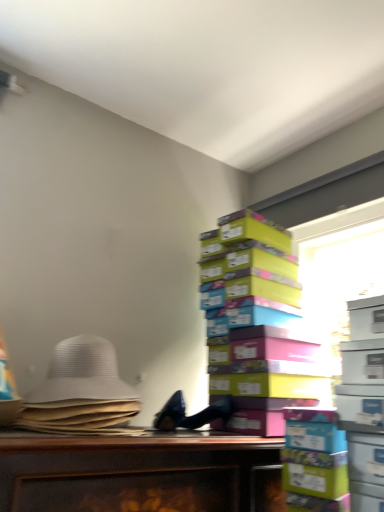
Question: Based on their positions, is white fabric hat at left located to the left or right of multicolored cardboard boxes at right?

Choices:
 (A) left
 (B) right

Answer: (A)

Question: Is white fabric hat at left in front of or behind multicolored cardboard boxes at right in the image?

Choices:
 (A) behind
 (B) front

Answer: (B)

Question: Which object is positioned farthest from the transparent plastic window screen at upper right?

Choices:
 (A) multicolored cardboard boxes at right
 (B) white fabric hat at left

Answer: (B)

Question: Which of these objects is positioned farthest from the multicolored cardboard boxes at right?

Choices:
 (A) white fabric hat at left
 (B) transparent plastic window screen at upper right

Answer: (A)